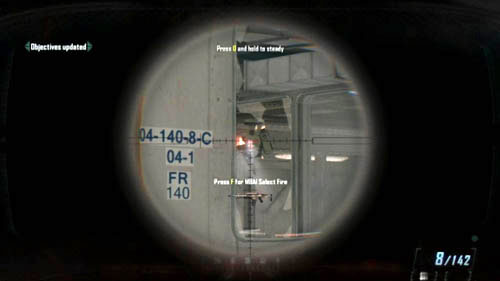
Locate an element on the screen. The height and width of the screenshot is (281, 500). vent is located at coordinates click(286, 77).